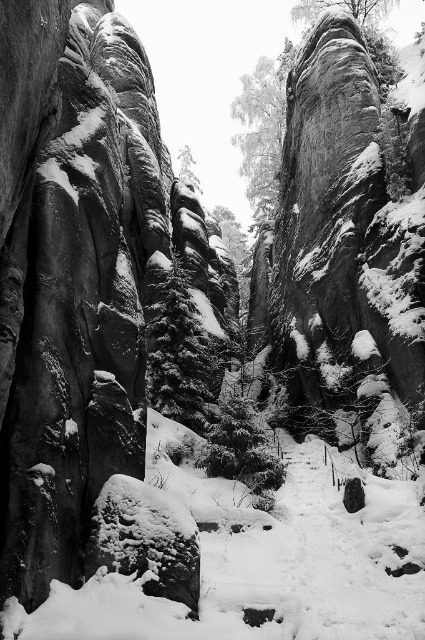
Consider the image. You are a hiker trying to navigate through the canyon. You see the green textured evergreen tree at center and the green textured pine at center. Which tree is closer to you?

The green textured evergreen tree at center is closer to you because it is in front of the green textured pine at center.

You are an environmental scientist assessing the canyon. You observe the green textured evergreen tree at center and the green textured pine at center. Which tree has a wider trunk?

The green textured pine at center has a wider trunk than the green textured evergreen tree at center.